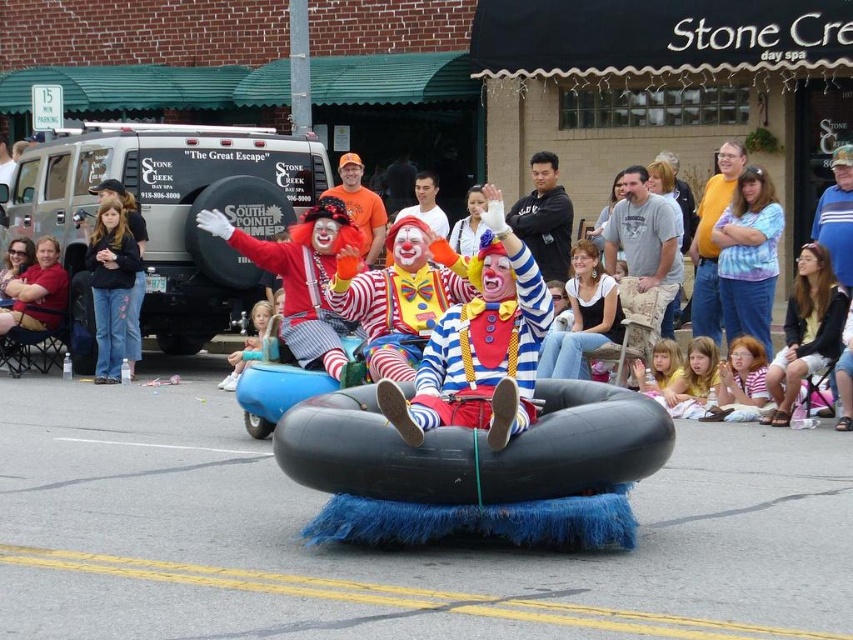
You are a photographer trying to capture a clear photo of both the matte clown costume at center and the matte brown leather jacket at left. Since you want to ensure both are fully visible in the frame, which object should you focus on first to account for their sizes?

The matte clown costume at center is taller than the matte brown leather jacket at left. Therefore, you should focus on the matte clown costume at center first to ensure its full height is captured before adjusting the frame for the shorter jacket.